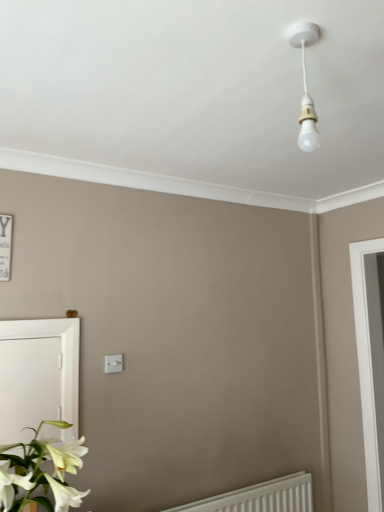
Question: From a real-world perspective, is white glossy screen door at lower left on top of white glossy flower at lower left?

Choices:
 (A) no
 (B) yes

Answer: (B)

Question: From the image's perspective, is white glossy screen door at lower left under white glossy flower at lower left?

Choices:
 (A) no
 (B) yes

Answer: (A)

Question: Is white glossy flower at lower left at the back of white glossy screen door at lower left?

Choices:
 (A) no
 (B) yes

Answer: (A)

Question: Can you confirm if white glossy screen door at lower left is taller than white glossy flower at lower left?

Choices:
 (A) yes
 (B) no

Answer: (A)

Question: Is white glossy flower at lower left surrounded by white glossy screen door at lower left?

Choices:
 (A) yes
 (B) no

Answer: (B)

Question: From their relative heights in the image, would you say white plastic radiator at lower right is taller or shorter than white glossy screen door at lower left?

Choices:
 (A) tall
 (B) short

Answer: (B)

Question: Which is correct: white plastic radiator at lower right is inside white glossy screen door at lower left, or outside of it?

Choices:
 (A) outside
 (B) inside

Answer: (A)

Question: Relative to white glossy screen door at lower left, is white plastic radiator at lower right in front or behind?

Choices:
 (A) front
 (B) behind

Answer: (B)

Question: Is point pos(249,488) positioned closer to the camera than point pos(39,414)?

Choices:
 (A) farther
 (B) closer

Answer: (A)

Question: Based on their positions, is white plastic light switch at center located to the left or right of white plastic radiator at lower right?

Choices:
 (A) left
 (B) right

Answer: (A)

Question: Is white plastic light switch at center in front of or behind white plastic radiator at lower right in the image?

Choices:
 (A) front
 (B) behind

Answer: (B)

Question: In terms of height, does white plastic light switch at center look taller or shorter compared to white plastic radiator at lower right?

Choices:
 (A) short
 (B) tall

Answer: (A)

Question: Considering the positions of point (115, 371) and point (198, 506), is point (115, 371) closer or farther from the camera than point (198, 506)?

Choices:
 (A) closer
 (B) farther

Answer: (A)

Question: Is white glossy flower at lower left in front of or behind white plastic light switch at center in the image?

Choices:
 (A) behind
 (B) front

Answer: (B)

Question: From their relative heights in the image, would you say white glossy flower at lower left is taller or shorter than white plastic light switch at center?

Choices:
 (A) short
 (B) tall

Answer: (B)